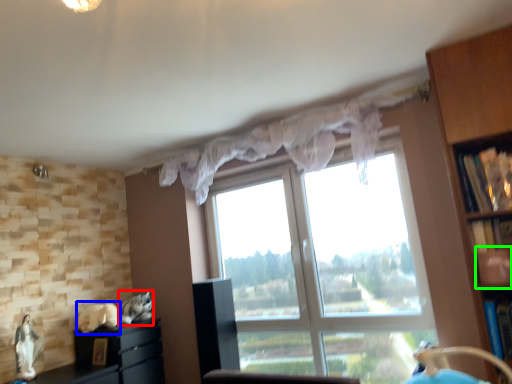
Question: Which object is the farthest from animal (highlighted by a red box)? Choose among these: animal (highlighted by a blue box) or shelf (highlighted by a green box).

Choices:
 (A) animal
 (B) shelf

Answer: (B)